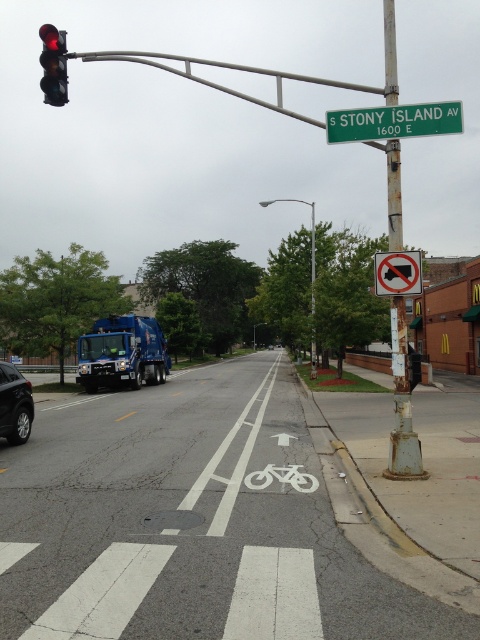
Question: Does rusty metal pole at center-right have a lesser width compared to red glass traffic light at upper left?

Choices:
 (A) yes
 (B) no

Answer: (A)

Question: Where is silver metallic sedan at left located in relation to white plastic no left turn at upper center in the image?

Choices:
 (A) above
 (B) below

Answer: (B)

Question: Considering the real-world distances, which object is farthest from the white painted bicycle lane at center?

Choices:
 (A) rusty metal pole at center-right
 (B) white plastic no left turn at upper center
 (C) green plastic street sign at upper center

Answer: (A)

Question: Which object is farther from the camera taking this photo?

Choices:
 (A) rusty metal pole at center-right
 (B) silver metallic sedan at left
 (C) white plastic no left turn at upper center

Answer: (B)

Question: Which is farther from the white painted bicycle lane at center?

Choices:
 (A) rusty metal pole at center-right
 (B) white plastic no left turn at upper center
 (C) red glass traffic light at upper left

Answer: (C)

Question: Is white painted bicycle lane at center thinner than silver metallic sedan at left?

Choices:
 (A) yes
 (B) no

Answer: (B)